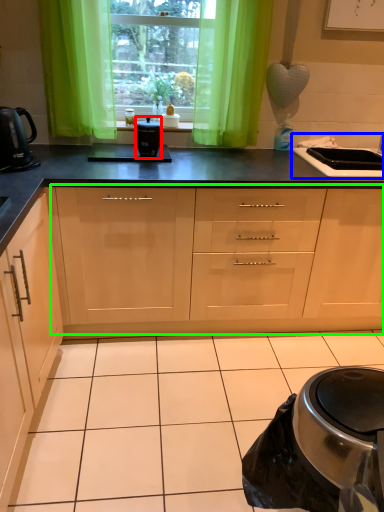
Question: Which object is the farthest from kitchen appliance (highlighted by a red box)? Choose among these: sink (highlighted by a blue box) or cabinetry (highlighted by a green box).

Choices:
 (A) sink
 (B) cabinetry

Answer: (A)